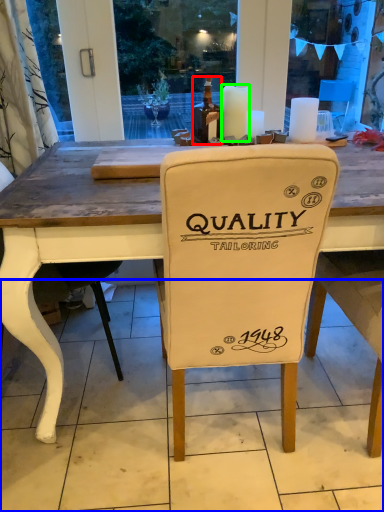
Question: Estimate the real-world distances between objects in this image. Which object is closer to bottle (highlighted by a red box), tile (highlighted by a blue box) or candle (highlighted by a green box)?

Choices:
 (A) tile
 (B) candle

Answer: (B)